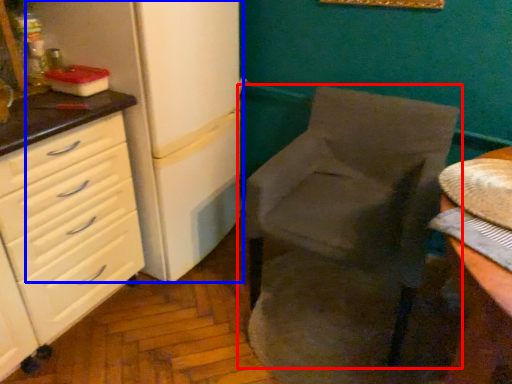
Question: Which object appears farthest to the camera in this image, chair (highlighted by a red box) or refrigerator (highlighted by a blue box)?

Choices:
 (A) chair
 (B) refrigerator

Answer: (B)